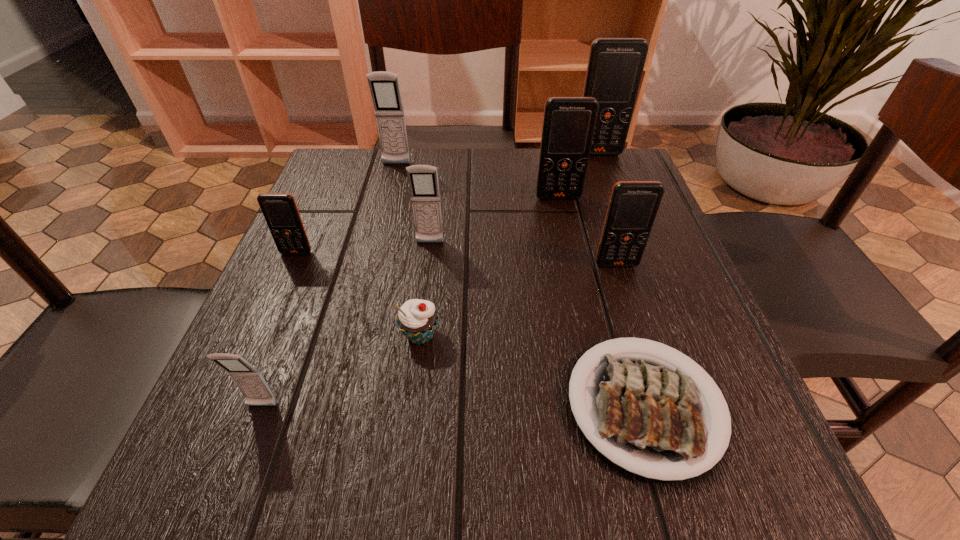
Identify the location of vacant area between the tallest cellular telephone and the seventh object from right to left. The height and width of the screenshot is (540, 960). tap(497, 159).

Where is `vacant point located between the second farthest object and the leftmost gray cellular telephone`? This screenshot has width=960, height=540. vacant point located between the second farthest object and the leftmost gray cellular telephone is located at coordinates (329, 285).

You are a GUI agent. You are given a task and a screenshot of the screen. Output one action in this format:
    pyautogui.click(x=<x>, y=<y>)
    Task: Click on the unoccupied area between the tallest cellular telephone and the plate
    
    Given the screenshot: What is the action you would take?
    (621, 280)

The width and height of the screenshot is (960, 540). In order to click on vacant area that lies between the third object from left to right and the fourth nearest object in this screenshot , I will do `click(507, 214)`.

Locate an element on the screen. This screenshot has height=540, width=960. free point between the third biggest orange cellular telephone and the second nearest orange cellular telephone is located at coordinates [x=457, y=259].

Where is `empty location between the farthest orange cellular telephone and the smallest gray cellular telephone`? The image size is (960, 540). empty location between the farthest orange cellular telephone and the smallest gray cellular telephone is located at coordinates (430, 280).

Choose which object is the second nearest neighbor to the nearest orange cellular telephone. Please provide its 2D coordinates. Your answer should be formatted as a tuple, i.e. [(x, y)], where the tuple contains the x and y coordinates of a point satisfying the conditions above.

[(569, 123)]

Choose which object is the sixth nearest neighbor to the leftmost gray cellular telephone. Please provide its 2D coordinates. Your answer should be formatted as a tuple, i.e. [(x, y)], where the tuple contains the x and y coordinates of a point satisfying the conditions above.

[(384, 86)]

You are a GUI agent. You are given a task and a screenshot of the screen. Output one action in this format:
    pyautogui.click(x=<x>, y=<y>)
    Task: Click on the cellular telephone identified as the fourth closest to the nearest orange cellular telephone
    The width and height of the screenshot is (960, 540).
    Given the screenshot: What is the action you would take?
    pyautogui.click(x=384, y=86)

Where is `cellular telephone that can be found as the fifth closest to the cupcake`? This screenshot has width=960, height=540. cellular telephone that can be found as the fifth closest to the cupcake is located at coordinates (569, 123).